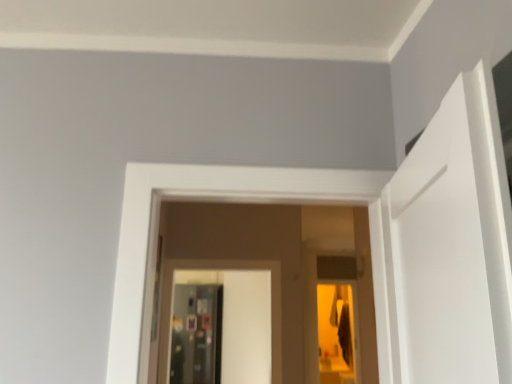
Question: Is metallic reflective screen door at center, placed as the 2th screen door when sorted from right to left, located outside metallic silver screen door at center, the 2th screen door in the back-to-front sequence?

Choices:
 (A) yes
 (B) no

Answer: (A)

Question: From the image's perspective, is metallic reflective screen door at center, placed as the 2th screen door when sorted from right to left, under metallic silver screen door at center, the 2th screen door in the back-to-front sequence?

Choices:
 (A) yes
 (B) no

Answer: (A)

Question: Does metallic reflective screen door at center, placed as the 2th screen door when sorted from right to left, have a lesser height compared to metallic silver screen door at center, arranged as the first screen door when viewed from the right?

Choices:
 (A) yes
 (B) no

Answer: (B)

Question: Is metallic reflective screen door at center, which is the 1th screen door in left-to-right order, to the left of metallic silver screen door at center, marked as the first screen door in a front-to-back arrangement, from the viewer's perspective?

Choices:
 (A) yes
 (B) no

Answer: (A)

Question: Is metallic reflective screen door at center, arranged as the 1th screen door when viewed from the back, taller than metallic silver screen door at center, marked as the first screen door in a front-to-back arrangement?

Choices:
 (A) yes
 (B) no

Answer: (A)

Question: Is metallic reflective screen door at center, placed as the 2th screen door when sorted from right to left, further to camera compared to metallic silver screen door at center, acting as the 2th screen door starting from the left?

Choices:
 (A) no
 (B) yes

Answer: (B)

Question: Does metallic silver screen door at center, acting as the 2th screen door starting from the left, appear on the right side of metallic reflective screen door at center, positioned as the second screen door in front-to-back order?

Choices:
 (A) no
 (B) yes

Answer: (B)

Question: Are metallic silver screen door at center, the 2th screen door in the back-to-front sequence, and metallic reflective screen door at center, arranged as the 1th screen door when viewed from the back, located far from each other?

Choices:
 (A) no
 (B) yes

Answer: (B)

Question: Considering the relative sizes of metallic silver screen door at center, marked as the first screen door in a front-to-back arrangement, and metallic reflective screen door at center, placed as the 2th screen door when sorted from right to left, in the image provided, is metallic silver screen door at center, marked as the first screen door in a front-to-back arrangement, bigger than metallic reflective screen door at center, placed as the 2th screen door when sorted from right to left,?

Choices:
 (A) no
 (B) yes

Answer: (A)

Question: From a real-world perspective, is metallic silver screen door at center, acting as the 2th screen door starting from the left, positioned over metallic reflective screen door at center, positioned as the second screen door in front-to-back order, based on gravity?

Choices:
 (A) yes
 (B) no

Answer: (A)

Question: Is metallic reflective screen door at center, placed as the 2th screen door when sorted from right to left, surrounded by metallic silver screen door at center, acting as the 2th screen door starting from the left?

Choices:
 (A) yes
 (B) no

Answer: (B)

Question: From the image's perspective, is metallic silver screen door at center, the 2th screen door in the back-to-front sequence, beneath metallic reflective screen door at center, positioned as the second screen door in front-to-back order?

Choices:
 (A) no
 (B) yes

Answer: (A)

Question: Considering the positions of metallic silver screen door at center, marked as the first screen door in a front-to-back arrangement, and metallic reflective screen door at center, placed as the 2th screen door when sorted from right to left, in the image, is metallic silver screen door at center, marked as the first screen door in a front-to-back arrangement, taller or shorter than metallic reflective screen door at center, placed as the 2th screen door when sorted from right to left,?

Choices:
 (A) short
 (B) tall

Answer: (A)